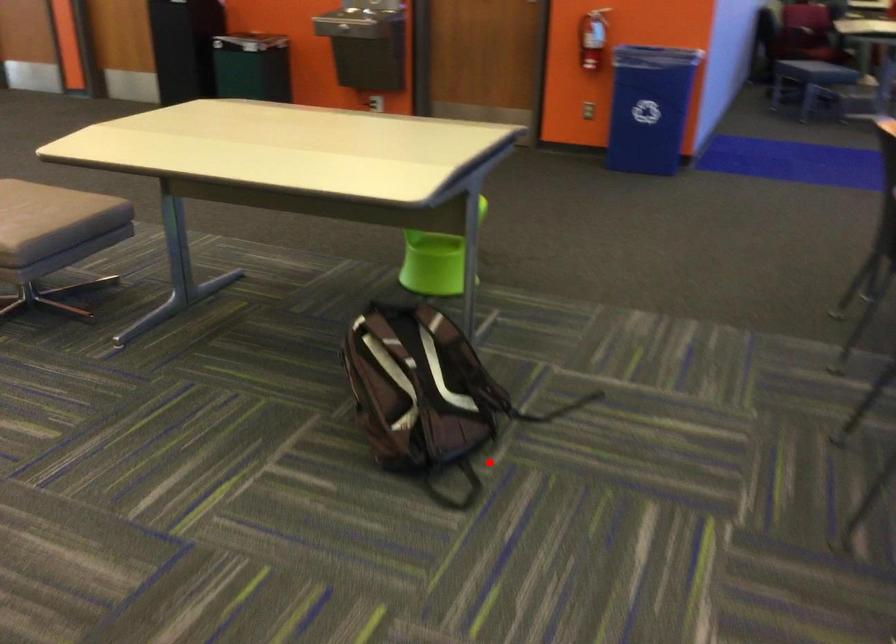
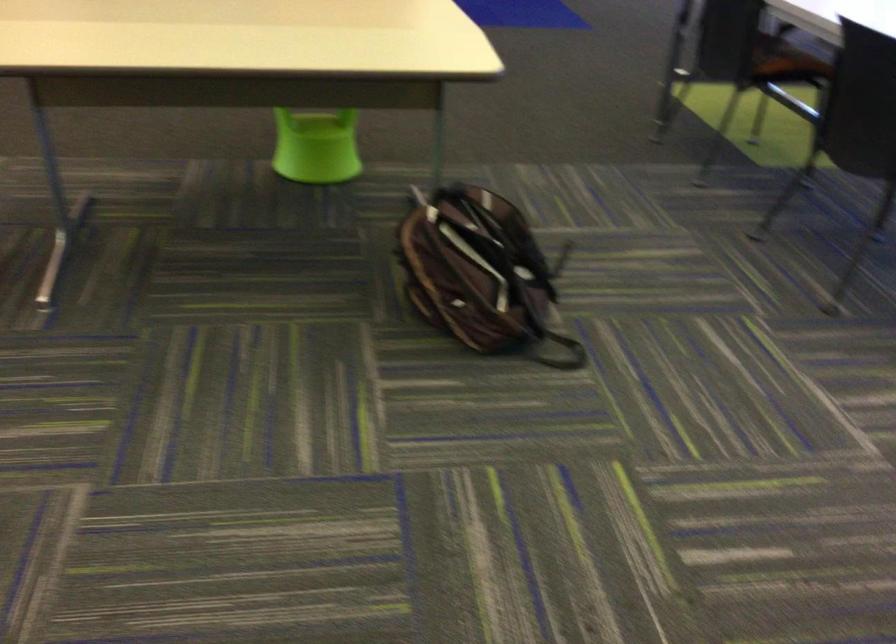
The point at the highlighted location is marked in the first image. Where is the corresponding point in the second image?

(552, 322)